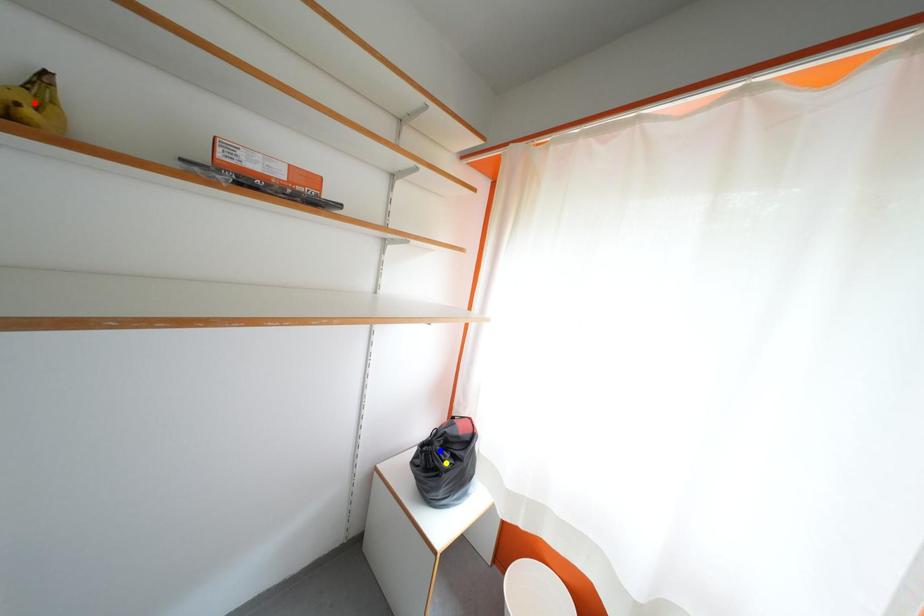
Order these from nearest to farthest:
1. blue point
2. red point
3. yellow point

red point, yellow point, blue point